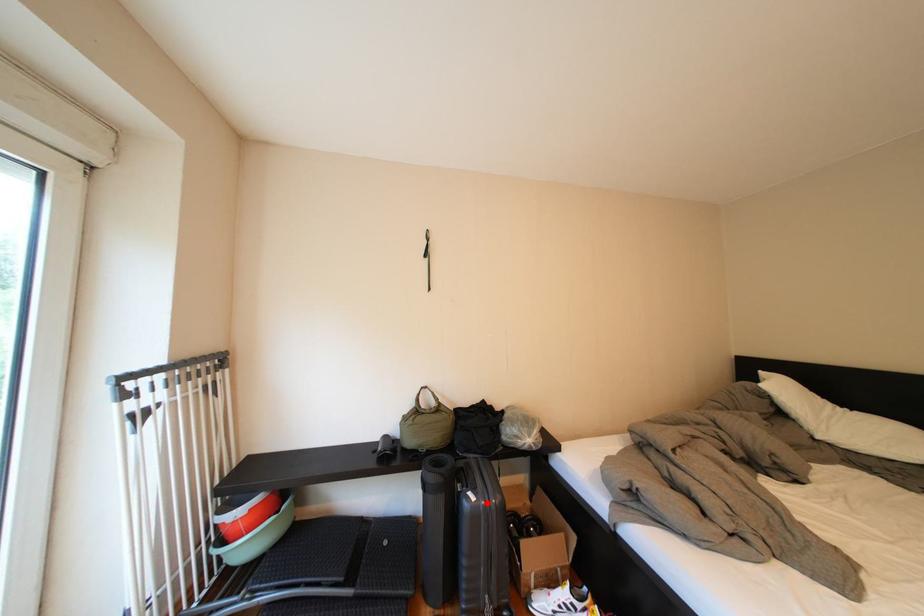
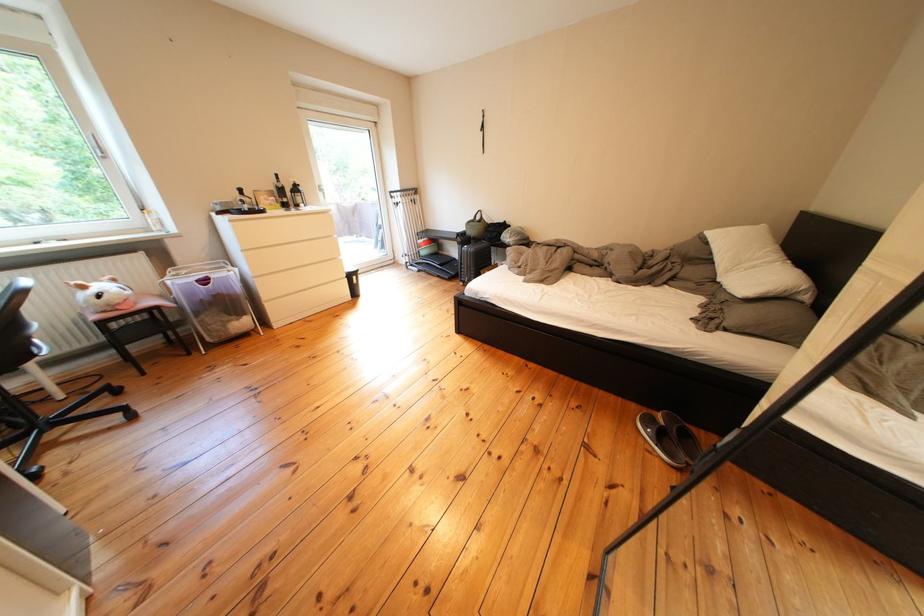
Question: I am providing you with two images of the same scene from different viewpoints. Image1 has a red point marked. In image2, the corresponding 3D location appears at what relative position? Reply with the corresponding letter.

Choices:
 (A) Closer
 (B) Farther

Answer: (A)